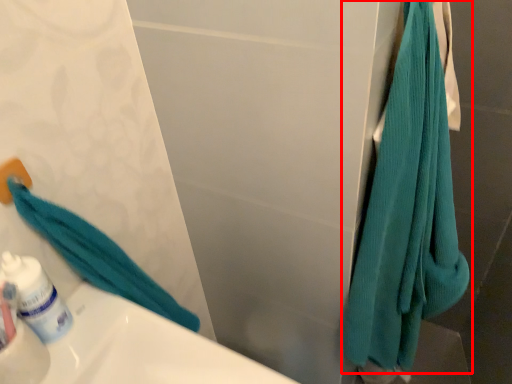
Question: From the image's perspective, what is the correct spatial relationship of towel (annotated by the red box) in relation to mouthwash?

Choices:
 (A) below
 (B) above

Answer: (B)